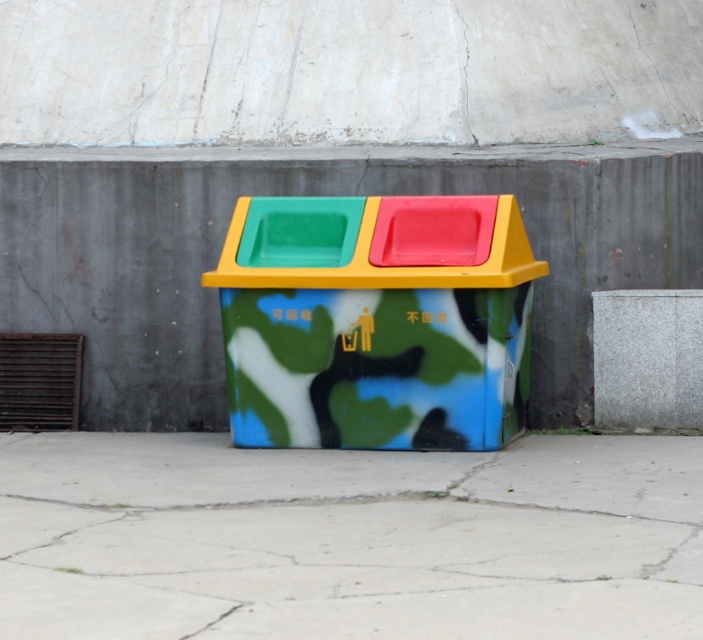
You are standing in front of a recycling bin and need to place a piece of trash. You notice the concrete at center and the gray concrete wall at center. Which one is located to the left from your perspective?

The concrete at center is to the left of the gray concrete wall at center.

You are a maintenance worker who needs to clean the gray concrete wall at center. The cleaning equipment requires a 1.2 meter working distance. Is the camouflage paint recycling bin at center too close to the wall to use the equipment?

The camouflage paint recycling bin at center is only 1.17 meters away from the gray concrete wall at center, which is less than the required 1.2 meters. Therefore, the equipment cannot be used due to insufficient space.

You are standing in front of the recycling bin and want to place a piece of paper on the concrete at center. Which direction should you move relative to the camouflage paint recycling bin at center?

The concrete at center is to the left of the camouflage paint recycling bin at center, so you should move to the left side of the camouflage paint recycling bin at center to place the paper on the concrete at center.